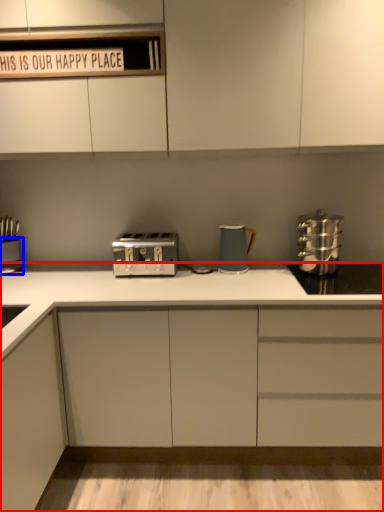
Question: Among these objects, which one is farthest to the camera, cabinetry (highlighted by a red box) or appliance (highlighted by a blue box)?

Choices:
 (A) cabinetry
 (B) appliance

Answer: (B)